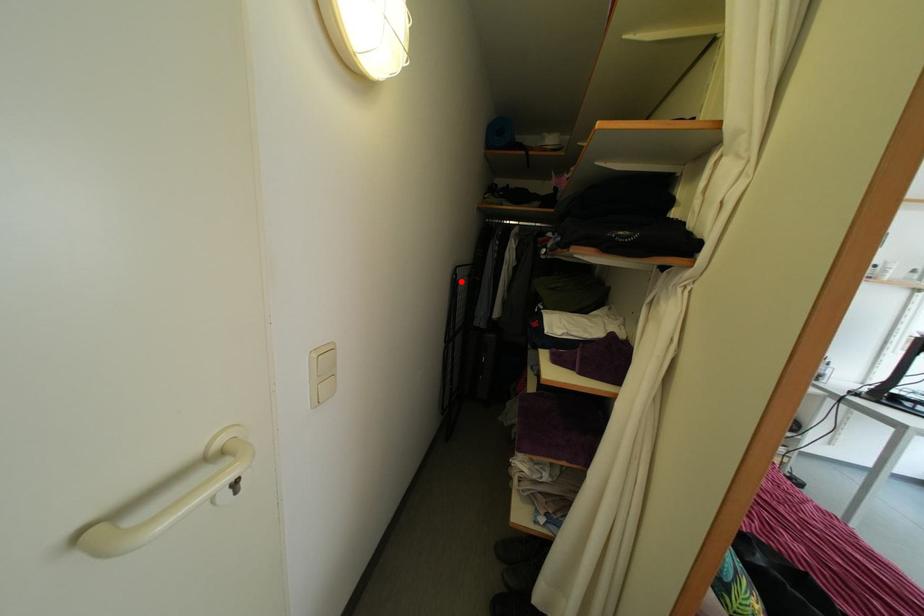
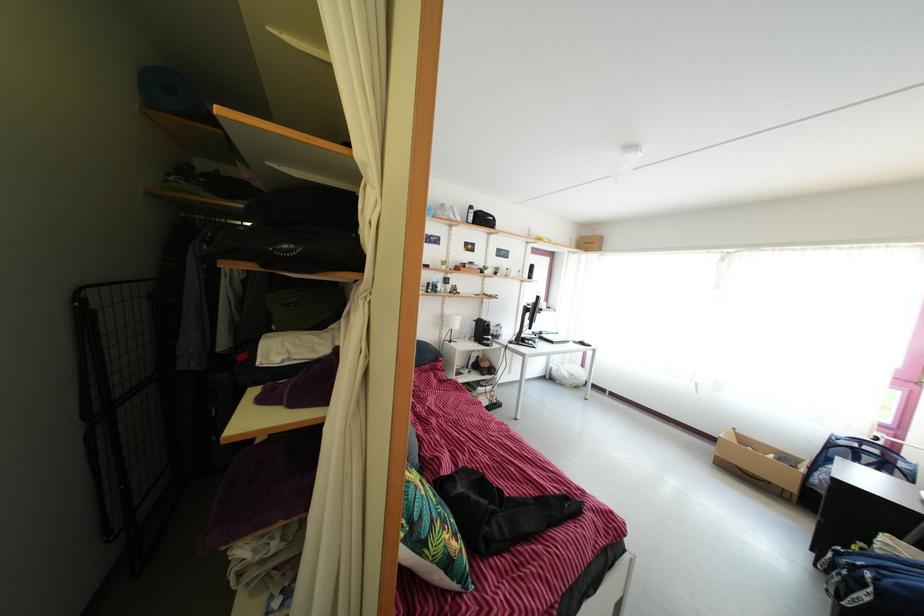
The point at the highlighted location is marked in the first image. Where is the corresponding point in the second image?

(86, 307)